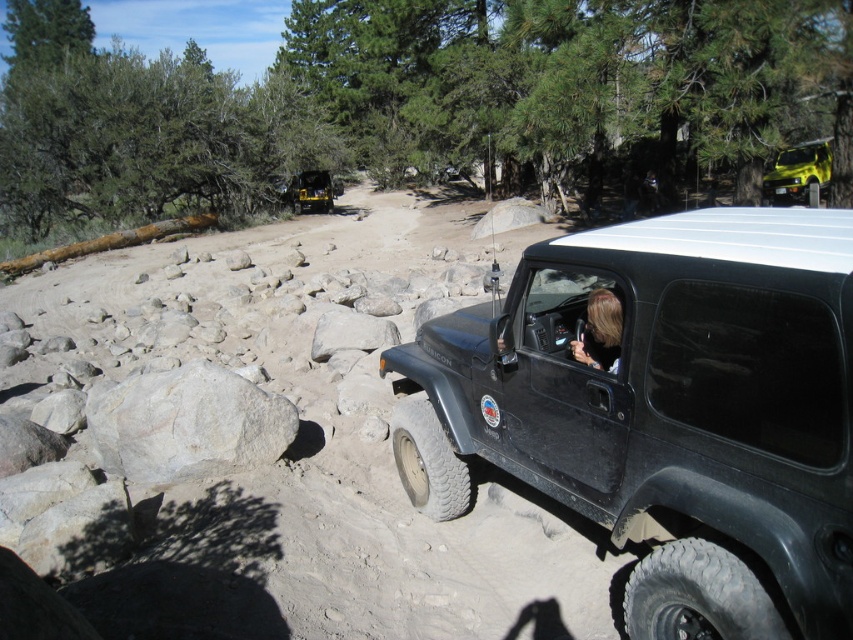
You are standing at the point marked by the coordinates point (666,412) in the image. What object is directly in front of you?

The point (666,412) indicates the matte black jeep at center, so the matte black jeep at center is directly in front of you.

You are a hiker planning to take a photo from the shiny yellow car at upper right. To get a clear view of the matte black jeep at center, should you move forward or backward?

The matte black jeep at center is positioned under the shiny yellow car at upper right, so to get a clear view of the matte black jeep at center, you should move backward to avoid blocking the view with the shiny yellow car at upper right.

You are planning to park your car in this rugged outdoor area. You have a car that is the same size as the shiny yellow car at upper right. Is there enough space to park it next to the matte black jeep at center without overlapping?

The matte black jeep at center has a lesser width compared to the shiny yellow car at upper right. Since the shiny yellow car at upper right is wider, there might not be enough space to park it next to the matte black jeep at center without overlapping. Check the available space carefully.